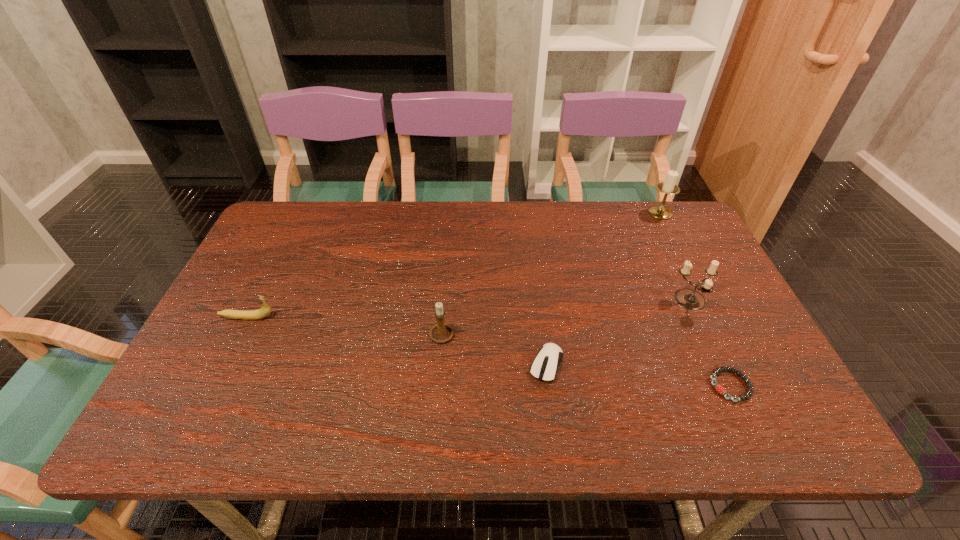
The height and width of the screenshot is (540, 960). Identify the location of vacant region between the second farthest candle holder and the farthest candle holder. (676, 257).

Locate an element on the screen. Image resolution: width=960 pixels, height=540 pixels. free spot between the leftmost object and the second nearest candle holder is located at coordinates (469, 309).

Where is `vacant area that lies between the leftmost object and the tallest candle holder`? vacant area that lies between the leftmost object and the tallest candle holder is located at coordinates (454, 265).

Where is `free spot between the second object from left to right and the leftmost object`? This screenshot has height=540, width=960. free spot between the second object from left to right and the leftmost object is located at coordinates (346, 326).

The image size is (960, 540). What are the coordinates of `vacant space that's between the mouse and the nearest candle holder` in the screenshot? It's located at (495, 349).

This screenshot has width=960, height=540. In order to click on vacant space that is in between the mouse and the fourth tallest object in this screenshot , I will do `click(396, 341)`.

This screenshot has width=960, height=540. Find the location of `empty location between the third object from left to right and the fourth farthest object`. empty location between the third object from left to right and the fourth farthest object is located at coordinates (495, 349).

Identify which object is located as the third nearest to the bracelet. Please provide its 2D coordinates. Your answer should be formatted as a tuple, i.e. [(x, y)], where the tuple contains the x and y coordinates of a point satisfying the conditions above.

[(440, 332)]

The width and height of the screenshot is (960, 540). I want to click on object that is the closest to the leftmost candle holder, so click(x=544, y=367).

I want to click on candle holder that is the closest one to the farthest candle holder, so click(x=689, y=299).